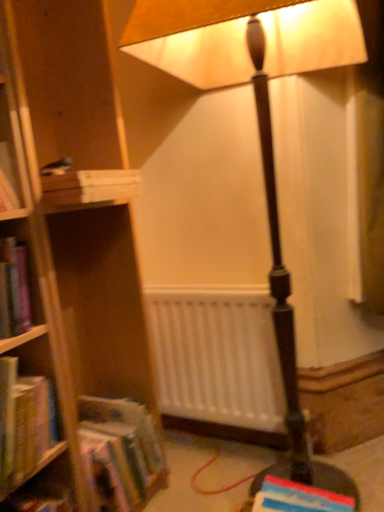
Question: Based on their positions, is hardcover book at lower right, which is counted as the 1th book, starting from the bottom, located to the left or right of white matte radiator at center?

Choices:
 (A) right
 (B) left

Answer: (A)

Question: In terms of size, does hardcover book at lower right, the fourth book positioned from the top, appear bigger or smaller than white matte radiator at center?

Choices:
 (A) big
 (B) small

Answer: (B)

Question: Which object is the farthest from the white matte radiator at center?

Choices:
 (A) hardcover book at lower right, the fourth book positioned from the top
 (B) matte brown lamp at center
 (C) wooden crate at left, acting as the 4th book starting from the bottom
 (D) hardcover book at left, the 2th book from the top
 (E) hardcover book at lower left, arranged as the 3th book when viewed from the top

Answer: (B)

Question: Considering the real-world distances, which object is farthest from the white matte radiator at center?

Choices:
 (A) hardcover book at lower left, arranged as the 3th book when viewed from the top
 (B) hardcover book at lower right, which is counted as the 1th book, starting from the bottom
 (C) hardcover book at left, the 3th book ordered from the bottom
 (D) wooden crate at left, acting as the 4th book starting from the bottom
 (E) matte brown lamp at center

Answer: (E)